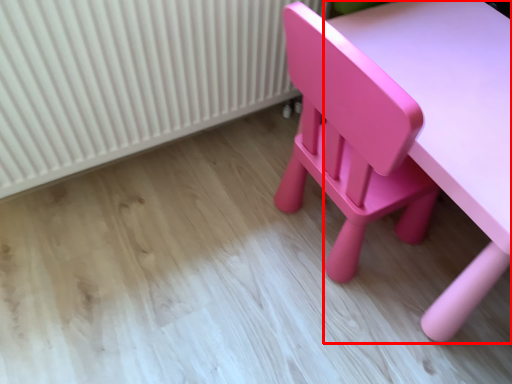
Question: From the image's perspective, where is table (annotated by the red box) located relative to radiator?

Choices:
 (A) above
 (B) below

Answer: (B)